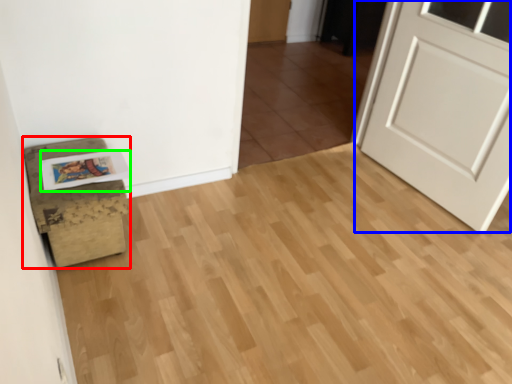
Question: Considering the real-world distances, which object is farthest from furniture (highlighted by a red box)? door (highlighted by a blue box) or postcard (highlighted by a green box)?

Choices:
 (A) door
 (B) postcard

Answer: (A)